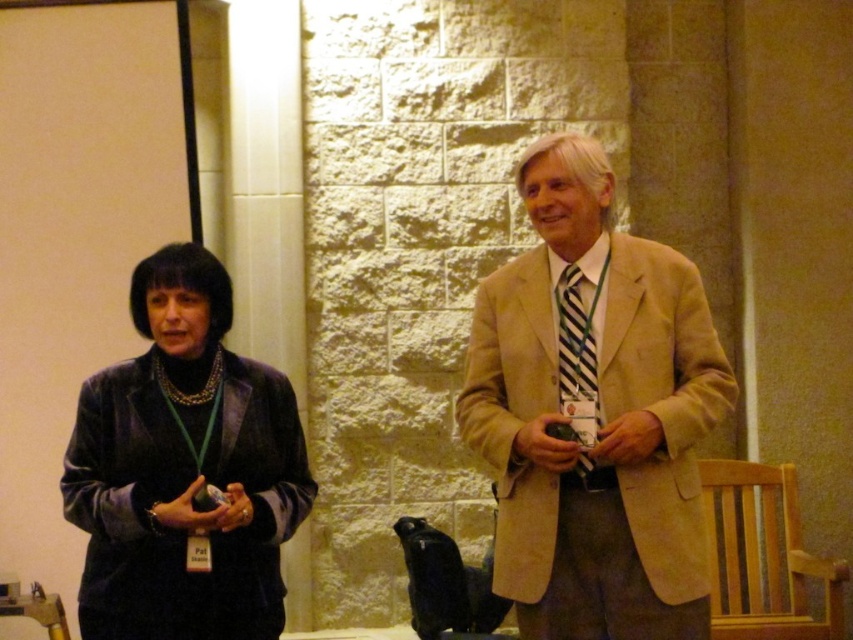
Is velvet black jacket at center bigger than beige wool suit at center?

No, velvet black jacket at center is not bigger than beige wool suit at center.

Between point (531, 580) and point (546, 634), which one is positioned behind?

The point (546, 634) is more distant.

I want to click on velvet black jacket at center, so click(595, 413).

Can you confirm if velvet black jacket at center is smaller than velvet black jacket at left?

No, velvet black jacket at center is not smaller than velvet black jacket at left.

Does point (532, 161) lie in front of point (247, 509)?

No, (532, 161) is behind (247, 509).

At what (x,y) coordinates should I click in order to perform the action: click on velvet black jacket at center. Please return your answer as a coordinate pair (x, y). The width and height of the screenshot is (853, 640). Looking at the image, I should click on (595, 413).

Between beige wool suit at center and velvet black jacket at left, which one is positioned higher?

Positioned higher is beige wool suit at center.

Find the location of a particular element. The width and height of the screenshot is (853, 640). beige wool suit at center is located at coordinates (595, 413).